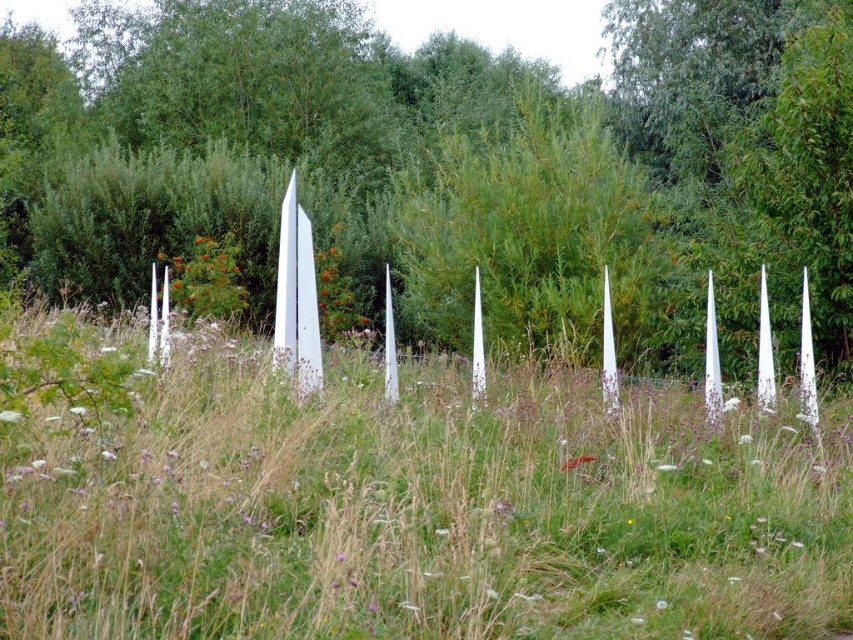
You are standing in the middle of the field and see the point marked at coordinates point (425, 513). What is located at that point?

The point (425, 513) indicates green grass at center.